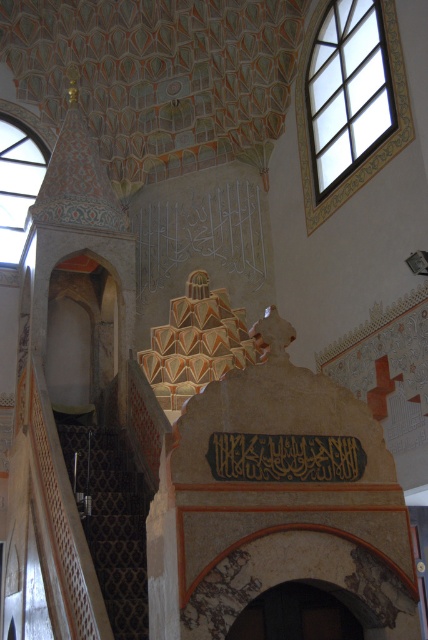
Based on the photo, you are a visitor entering the mosque and want to approach the minbar. You see the dark brown carpeted stairs at lower left and the black calligraphy at center. Which path is wider for you to walk through?

The dark brown carpeted stairs at lower left is wider than the black calligraphy at center, so the path through the dark brown carpeted stairs at lower left is wider for walking through.

You are an interior designer planning to place a large decorative rug in this space. You have two options based on the objects present here. Which object, the dark brown carpeted stairs at lower left or the black calligraphy at center, would you choose to place the rug in front of, considering their size?

The dark brown carpeted stairs at lower left is bigger than the black calligraphy at center, so placing the rug in front of the dark brown carpeted stairs at lower left would be more appropriate due to its larger size.